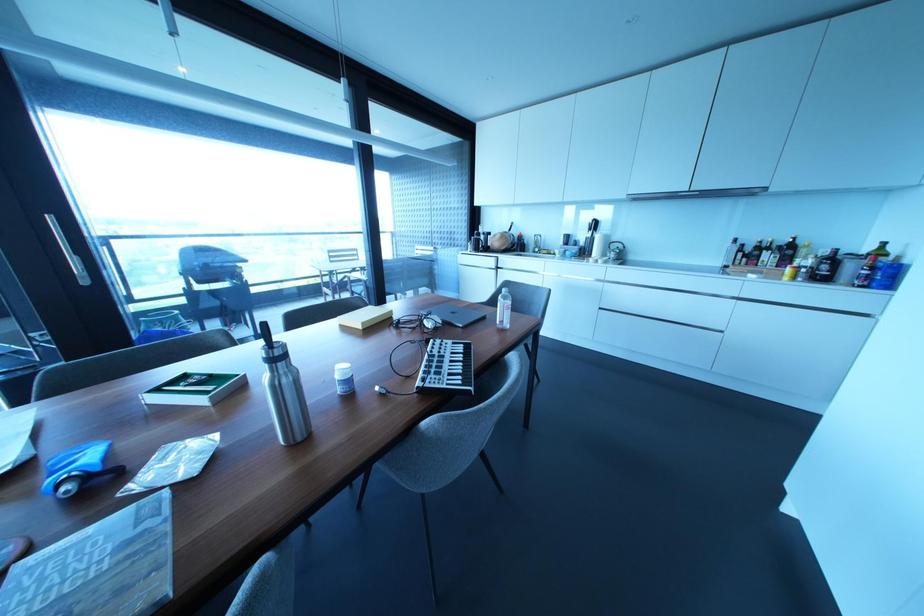
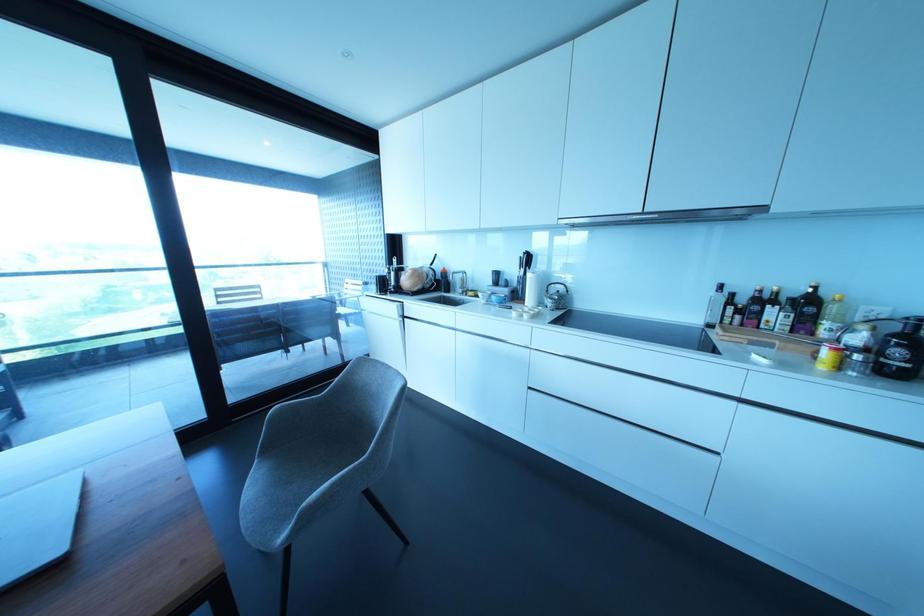
The point at (x=798, y=260) is marked in the first image. Where is the corresponding point in the second image?

(825, 323)